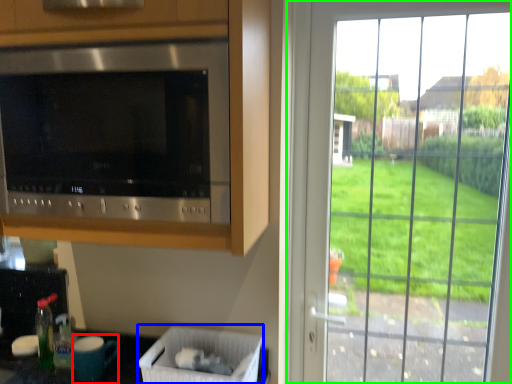
Question: Which object is the closest to the appliance (highlighted by a red box)? Choose among these: laundry basket (highlighted by a blue box) or window (highlighted by a green box).

Choices:
 (A) laundry basket
 (B) window

Answer: (A)